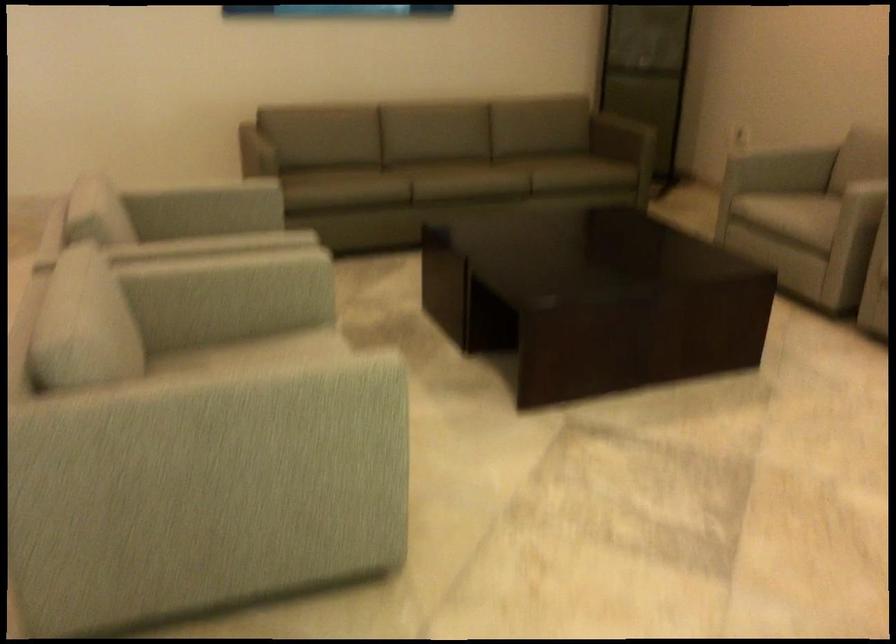
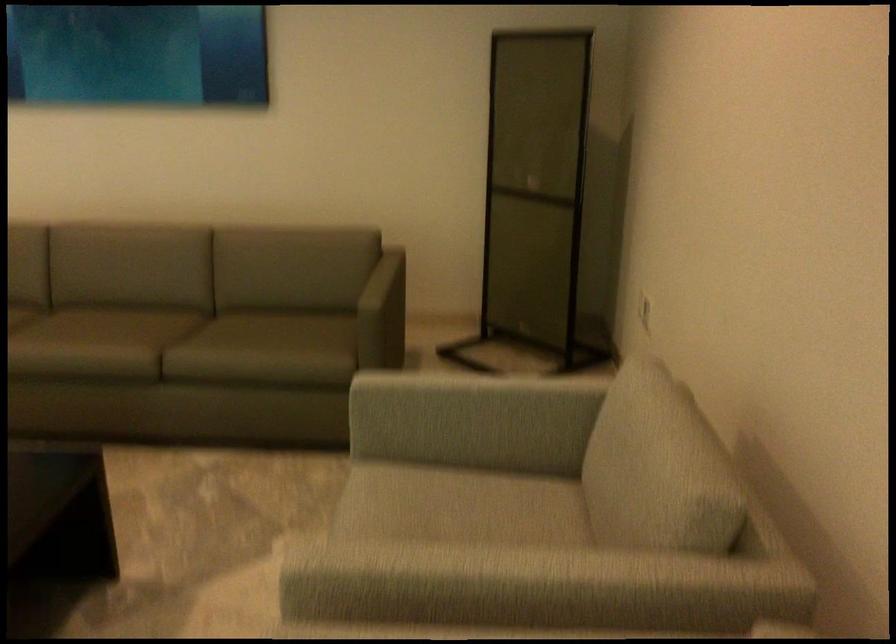
In the second image, find the point that corresponds to pixel 764 154 in the first image.

(469, 399)